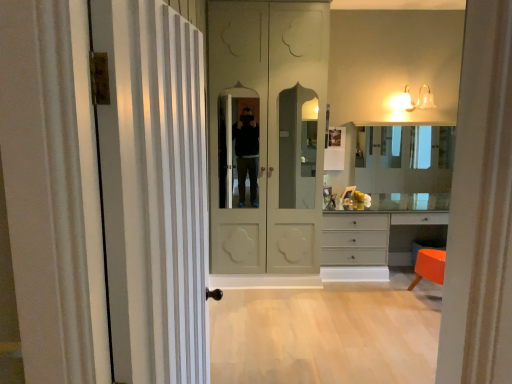
Question: Considering the positions of matte white bell-shaped light fixture at upper right and light wood floor at lower center in the image, is matte white bell-shaped light fixture at upper right taller or shorter than light wood floor at lower center?

Choices:
 (A) tall
 (B) short

Answer: (A)

Question: From the image's perspective, is matte white bell-shaped light fixture at upper right positioned above or below light wood floor at lower center?

Choices:
 (A) below
 (B) above

Answer: (B)

Question: Which is nearer to the matte gray dresser at lower right?

Choices:
 (A) white striped door at left, the 2th door positioned from the back
 (B) matte white bell-shaped light fixture at upper right
 (C) clear glass mirror at center
 (D) matte cream door at center, which appears as the second door when viewed from the front
 (E) light wood floor at lower center

Answer: (E)

Question: Which of these objects is positioned farthest from the white striped door at left, which is counted as the 1th door, starting from the front?

Choices:
 (A) light wood floor at lower center
 (B) matte white bell-shaped light fixture at upper right
 (C) clear glass mirror at center
 (D) matte cream door at center, which is the first door in back-to-front order
 (E) matte gray dresser at lower right

Answer: (B)